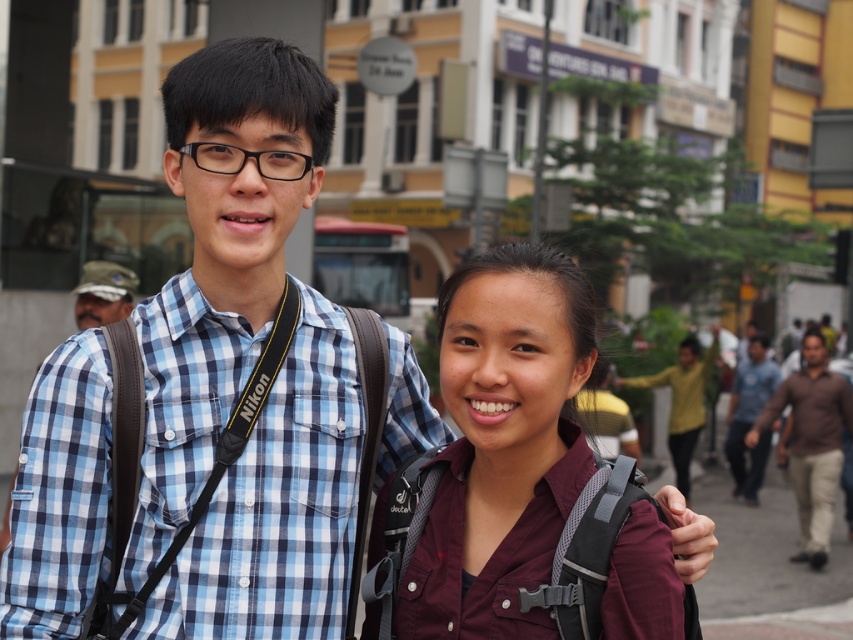
You are a photographer standing in front of the two people in the image. You want to take a photo that includes both the blue checkered shirt at center and the brown cotton shirt at right. Which person should you focus on first to ensure both are in focus?

You should focus on the blue checkered shirt at center first because it is closer to the viewer than the brown cotton shirt at right, so focusing on the closer object will help both be in focus.

You are a photographer trying to capture a wide shot of the blue checkered shirt at center and the dark blue jeans at right. Given their sizes, which object would require more space in the frame to avoid being cut off?

The blue checkered shirt at center requires more space in the frame because its width surpasses that of the dark blue jeans at right.

You are a photographer trying to capture a candid shot of the blue checkered shirt at center and the dark blue jeans at right. Based on their positions, which clothing item is positioned higher in the frame?

The blue checkered shirt at center is positioned higher in the frame than the dark blue jeans at right.